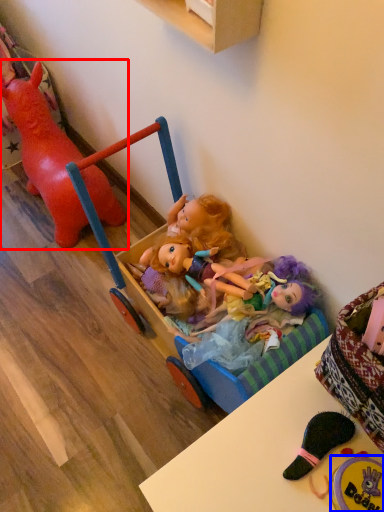
Question: Which point is closer to the camera, toy (highlighted by a red box) or toy (highlighted by a blue box)?

Choices:
 (A) toy
 (B) toy

Answer: (B)